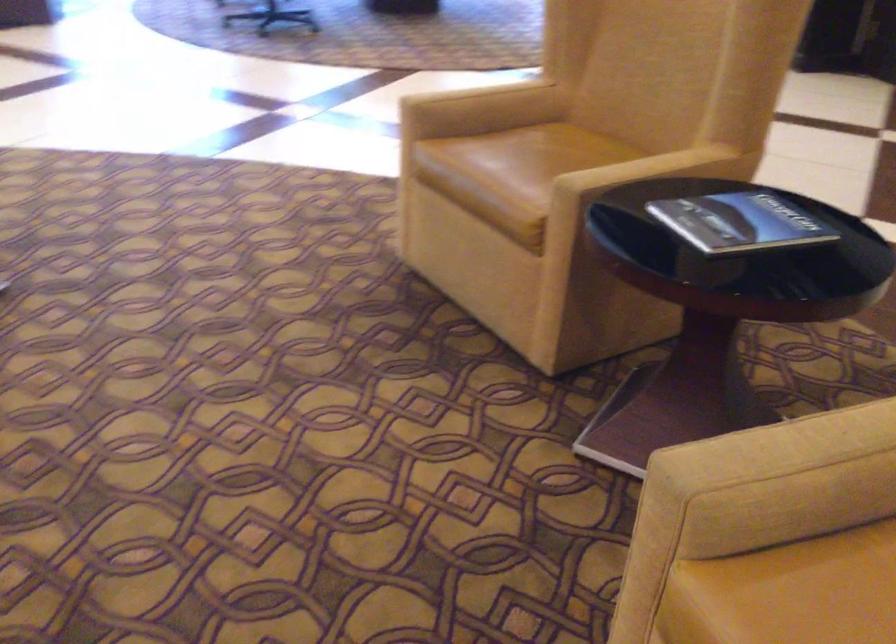
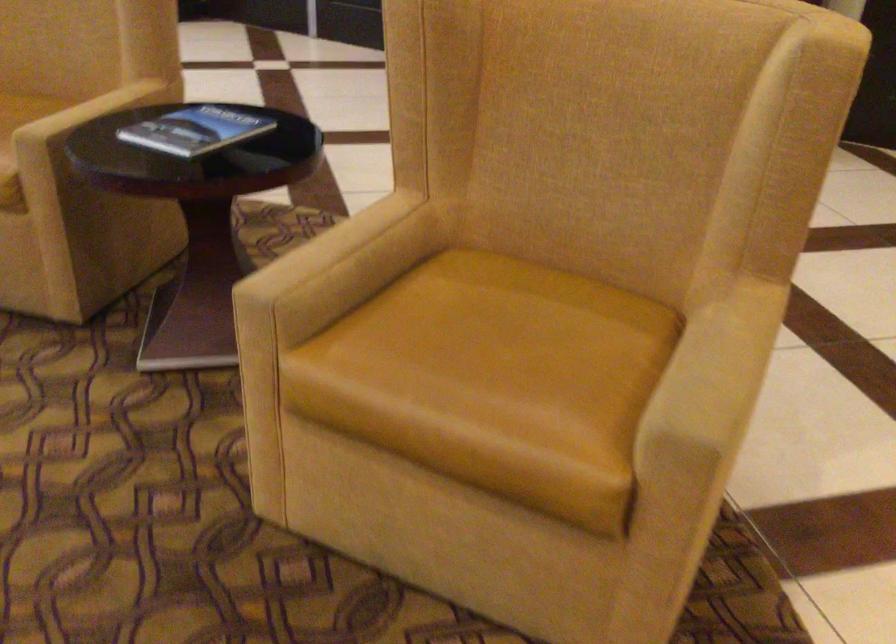
Question: The camera is either moving clockwise (left) or counter-clockwise (right) around the object. The first image is from the beginning of the video and the second image is from the end. Is the camera moving left or right when shooting the video?

Choices:
 (A) Left
 (B) Right

Answer: (A)